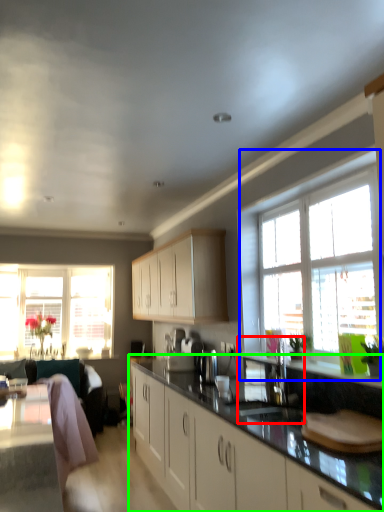
Question: Which object is positioned closest to sink (highlighted by a red box)? Select from window (highlighted by a blue box) and countertop (highlighted by a green box).

Choices:
 (A) window
 (B) countertop

Answer: (B)